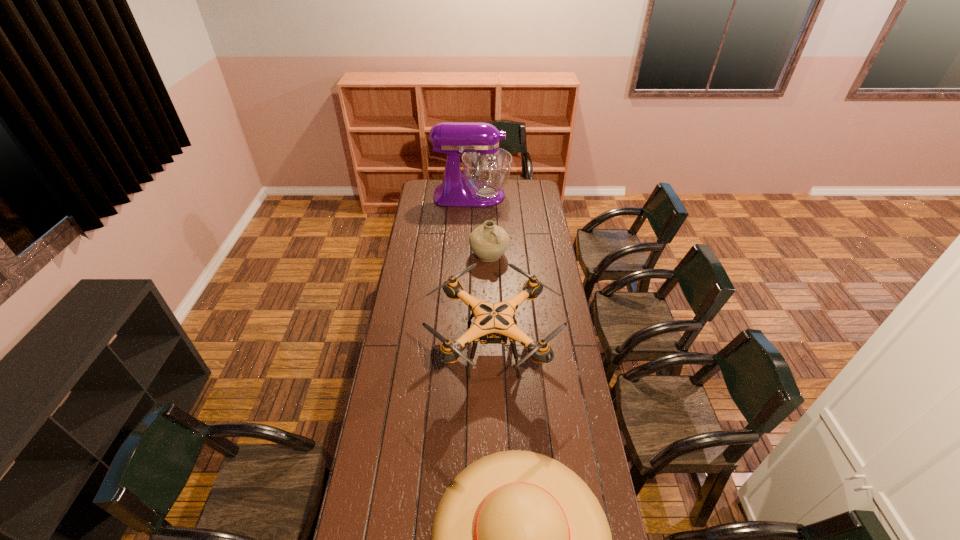
Identify the location of mixer. The width and height of the screenshot is (960, 540). (486, 168).

You are a GUI agent. You are given a task and a screenshot of the screen. Output one action in this format:
    pyautogui.click(x=<x>, y=<y>)
    Task: Click on the tallest object
    This screenshot has height=540, width=960.
    Given the screenshot: What is the action you would take?
    pyautogui.click(x=486, y=168)

Where is `drone`? This screenshot has height=540, width=960. drone is located at coordinates (493, 324).

I want to click on the second nearest object, so click(x=493, y=324).

You are a GUI agent. You are given a task and a screenshot of the screen. Output one action in this format:
    pyautogui.click(x=<x>, y=<y>)
    Task: Click on the pottery
    The height and width of the screenshot is (540, 960).
    Given the screenshot: What is the action you would take?
    pyautogui.click(x=488, y=242)

This screenshot has height=540, width=960. I want to click on the third nearest object, so click(488, 242).

Where is `free space located 0.080m at the bowl opening of the mixer`? free space located 0.080m at the bowl opening of the mixer is located at coordinates (523, 195).

Locate an element on the screen. vacant space located 0.050m on the camera mount of the second nearest object is located at coordinates (418, 348).

Find the location of a particular element. This screenshot has height=540, width=960. vacant space situated on the left of the second farthest object is located at coordinates (416, 255).

Locate an element on the screen. The image size is (960, 540). object that is positioned at the far edge is located at coordinates (486, 168).